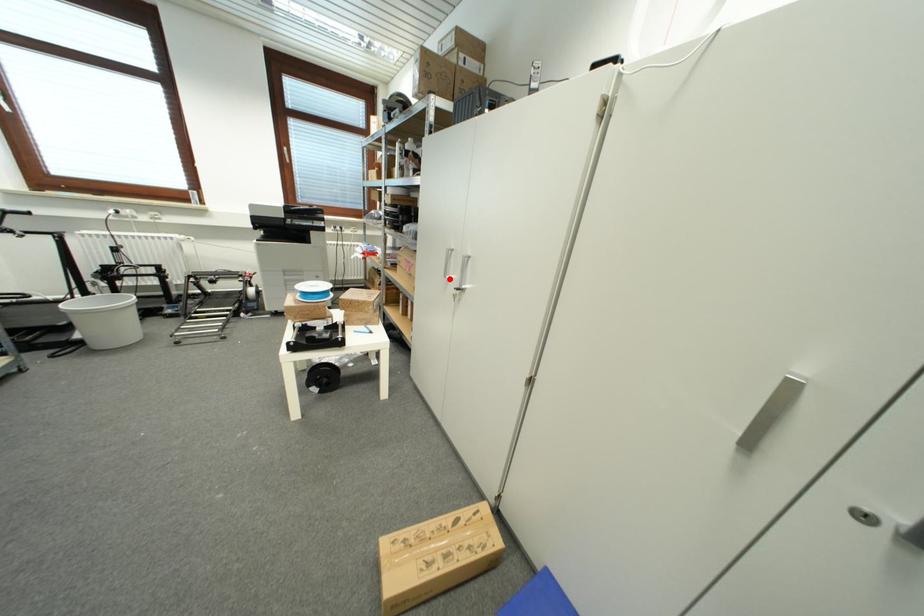
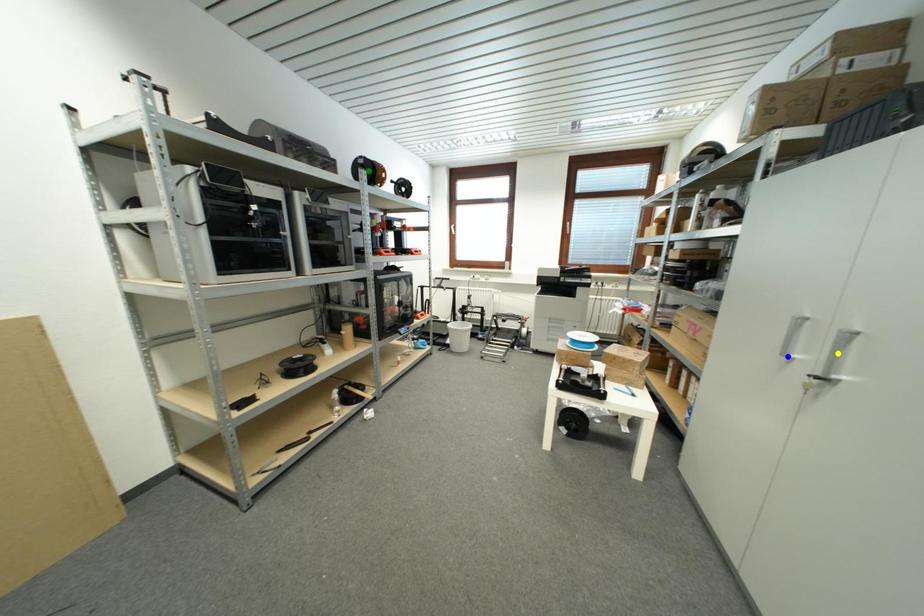
Question: I am providing you with two images of the same scene from different viewpoints. A red point is marked on the first image. You are given multiple points on the second image. Which point in image 2 is actually the same real-world point as the red point in image 1?

Choices:
 (A) yellow point
 (B) green point
 (C) blue point

Answer: (C)